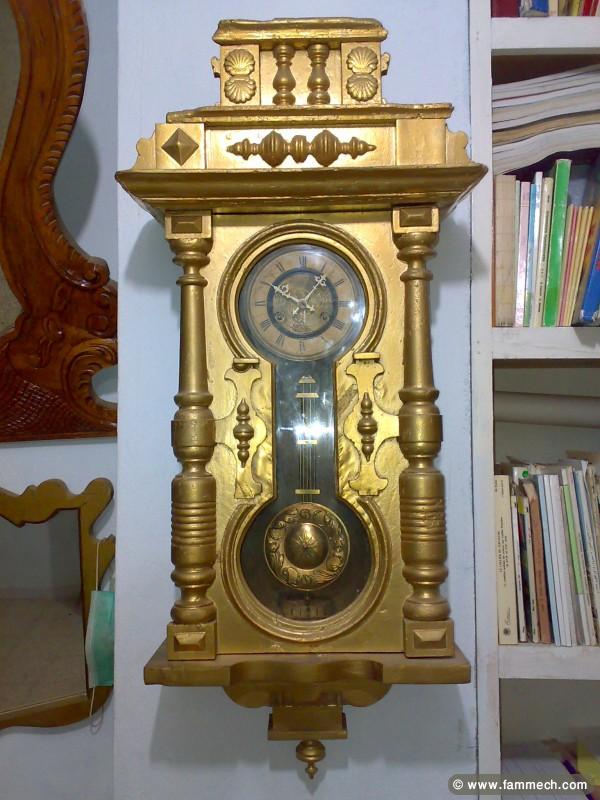
The width and height of the screenshot is (600, 800). I want to click on wooden frame, so click(62, 20), click(43, 402).